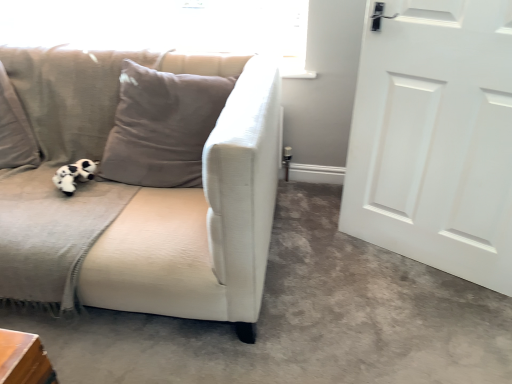
Find the location of a particular element. The width and height of the screenshot is (512, 384). free space in front of white matte door at right is located at coordinates (428, 312).